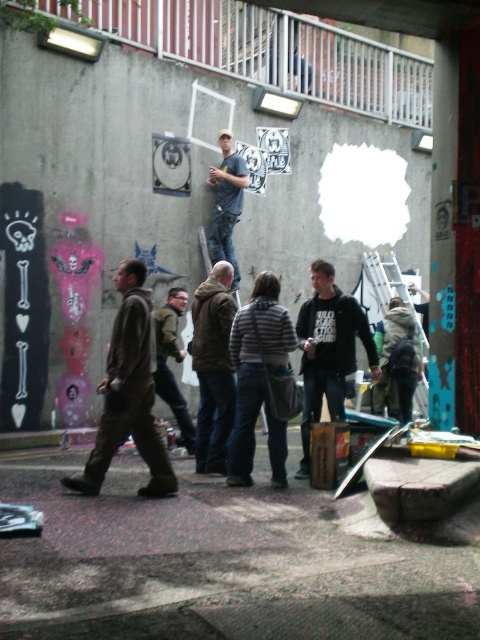
Who is positioned more to the left, dark brown jacket at left or black matte hoodie at center?

From the viewer's perspective, dark brown jacket at left appears more on the left side.

Is the position of dark brown jacket at left more distant than that of black matte hoodie at center?

That is False.

What do you see at coordinates (129, 394) in the screenshot? I see `dark brown jacket at left` at bounding box center [129, 394].

Find the location of a particular element. This screenshot has height=640, width=480. dark brown jacket at left is located at coordinates (129, 394).

Is dark brown leather jacket at center positioned before green matte jacket at center?

Yes.

Between dark brown leather jacket at center and green matte jacket at center, which one has more height?

Standing taller between the two is dark brown leather jacket at center.

Find the location of a particular element. Image resolution: width=480 pixels, height=640 pixels. dark brown leather jacket at center is located at coordinates (213, 365).

Is black matte hoodie at center below metallic silver ladder at center?

Correct, black matte hoodie at center is located below metallic silver ladder at center.

In order to click on black matte hoodie at center in this screenshot , I will do `click(328, 349)`.

Where is `black matte hoodie at center`? Image resolution: width=480 pixels, height=640 pixels. black matte hoodie at center is located at coordinates (328, 349).